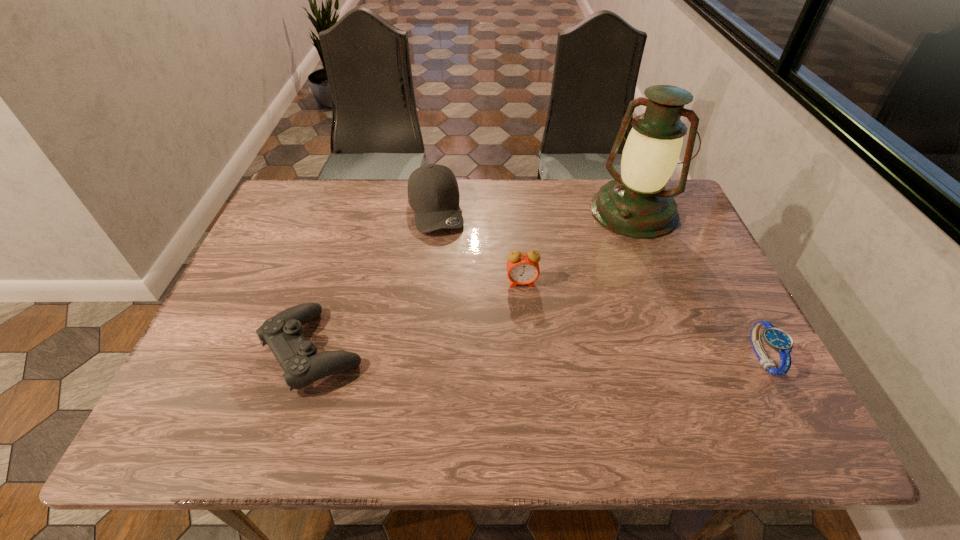
Image resolution: width=960 pixels, height=540 pixels. Identify the location of vacant space at the right edge. (661, 291).

This screenshot has width=960, height=540. In order to click on vacant area between the second object from left to right and the control in this screenshot , I will do `click(374, 280)`.

This screenshot has height=540, width=960. I want to click on free point between the third object from right to left and the lantern, so click(578, 247).

This screenshot has width=960, height=540. Find the location of `vacant region between the baseball cap and the tallest object`. vacant region between the baseball cap and the tallest object is located at coordinates (535, 210).

Locate an element on the screen. The height and width of the screenshot is (540, 960). free spot between the lantern and the alarm clock is located at coordinates (578, 247).

Locate an element on the screen. The height and width of the screenshot is (540, 960). vacant area between the lantern and the baseball cap is located at coordinates (535, 210).

Identify the location of blank region between the baseball cap and the control. This screenshot has width=960, height=540. (374, 280).

Locate an element on the screen. The height and width of the screenshot is (540, 960). vacant area between the watch and the third object from right to left is located at coordinates (641, 320).

At what (x,y) coordinates should I click in order to perform the action: click on unoccupied area between the lantern and the control. Please return your answer as a coordinate pair (x, y). Image resolution: width=960 pixels, height=540 pixels. Looking at the image, I should click on (473, 281).

You are a GUI agent. You are given a task and a screenshot of the screen. Output one action in this format:
    pyautogui.click(x=<x>, y=<y>)
    Task: Click on the free point between the leftmost object and the baseball cap
    
    Given the screenshot: What is the action you would take?
    pyautogui.click(x=374, y=280)